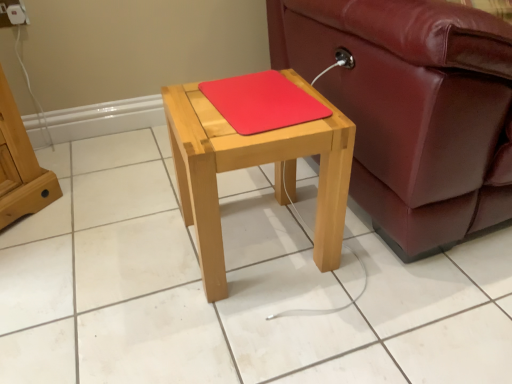
This screenshot has width=512, height=384. Find the location of `vacant space situated above rubberized red mousepad at center (from a real-world perspective)`. vacant space situated above rubberized red mousepad at center (from a real-world perspective) is located at coordinates (265, 92).